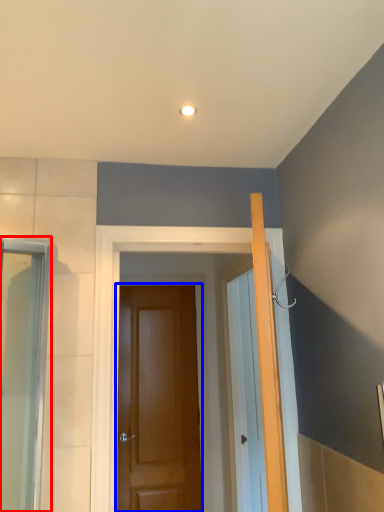
Question: Which of the following is the farthest to the observer, screen door (highlighted by a red box) or door (highlighted by a blue box)?

Choices:
 (A) screen door
 (B) door

Answer: (B)